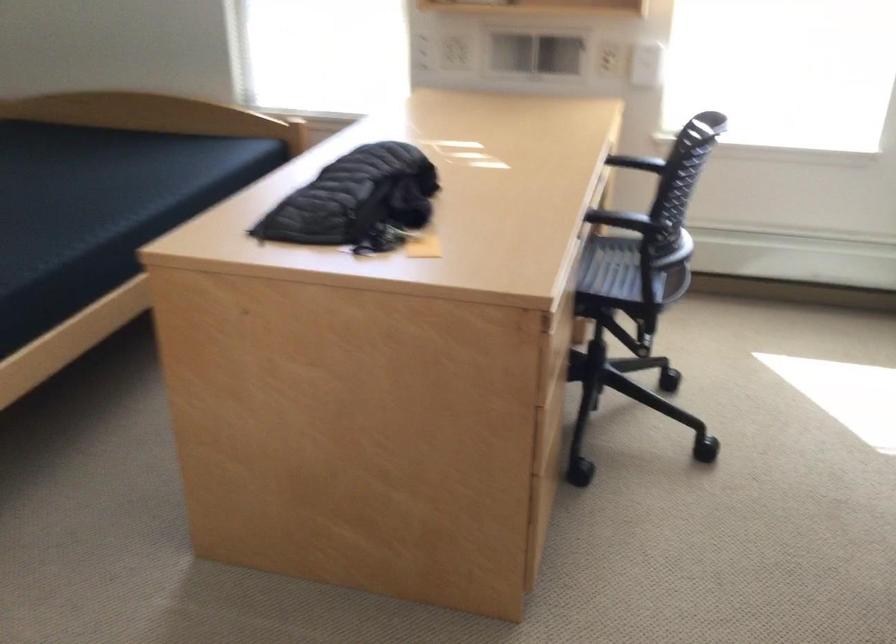
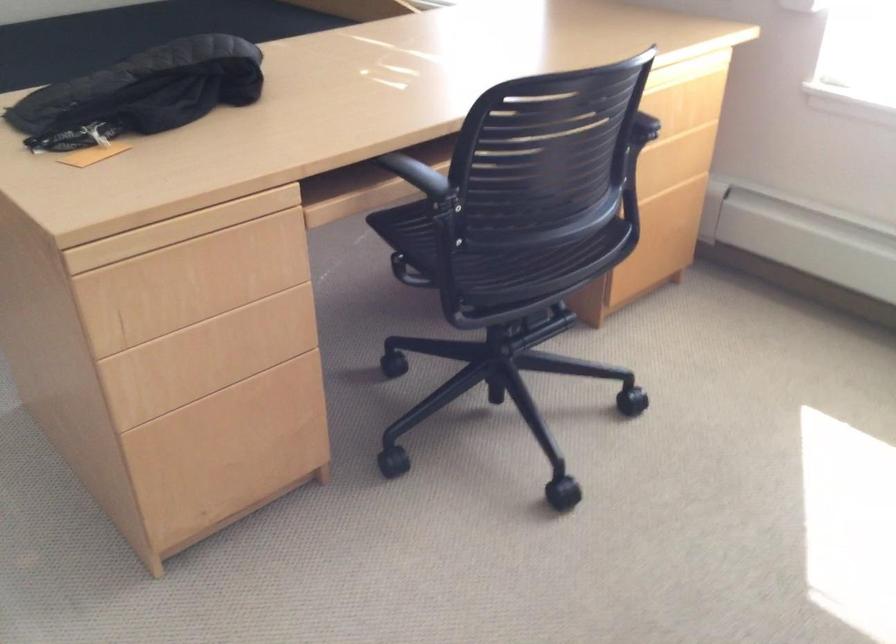
Locate, in the second image, the point that corresponds to (547,399) in the first image.

(201, 361)